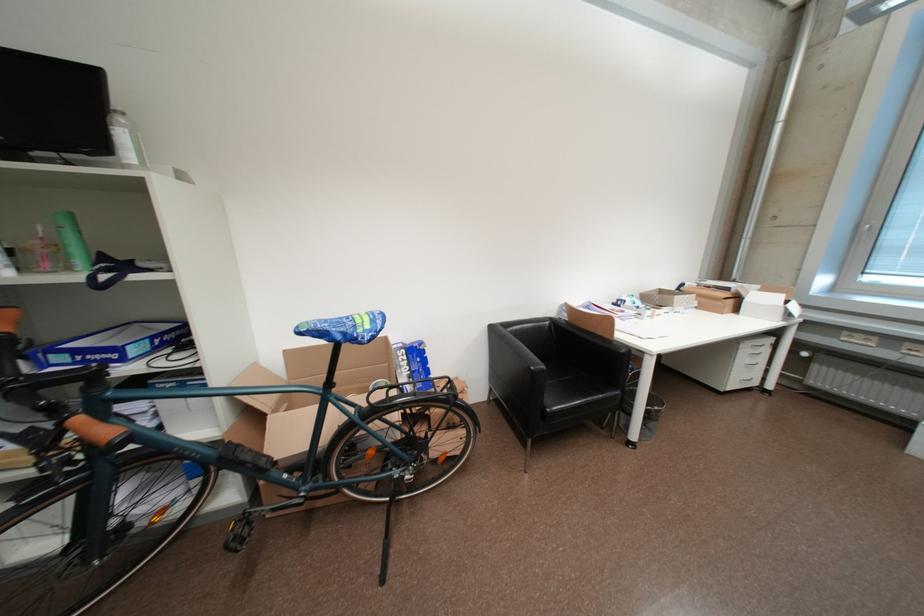
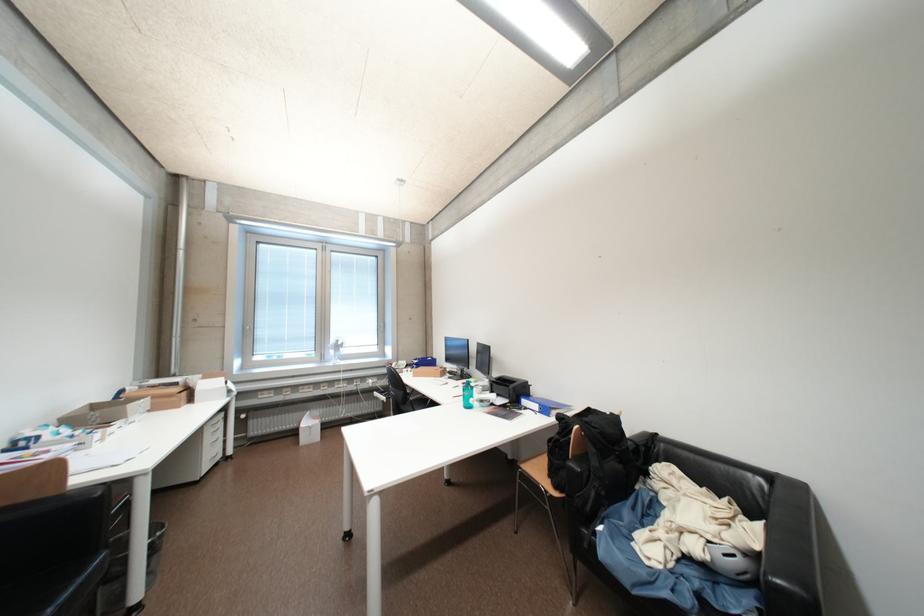
Find the pixel in the second image that matches (736,292) in the first image.

(184, 386)